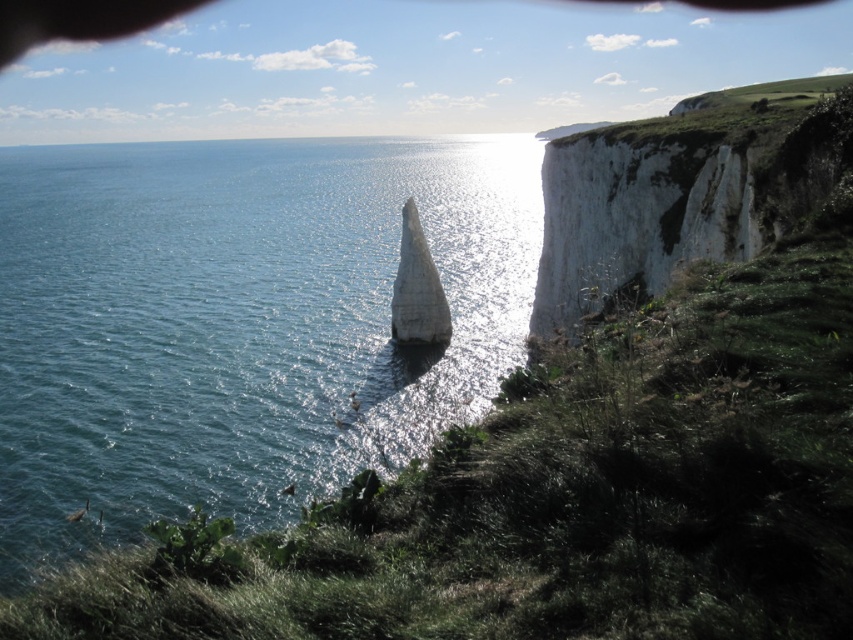
Question: Can you confirm if blue water at center is thinner than white rocky cliff at upper right?

Choices:
 (A) yes
 (B) no

Answer: (B)

Question: Does blue water at center have a lesser width compared to white rocky cliff at upper right?

Choices:
 (A) yes
 (B) no

Answer: (B)

Question: Among these objects, which one is nearest to the camera?

Choices:
 (A) blue water at center
 (B) white rocky cliff at upper right

Answer: (B)

Question: In this image, where is blue water at center located relative to white rocky cliff at upper right?

Choices:
 (A) left
 (B) right

Answer: (A)